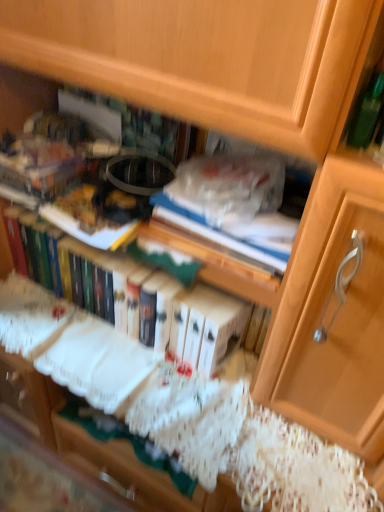
Describe the element at coordinates (150, 304) in the screenshot. This screenshot has height=512, width=384. I see `hardcover book at center` at that location.

I want to click on hardcover book at center, so click(150, 304).

What is the approximate height of blue hardcover book at center?

It is 4.76 inches.

Image resolution: width=384 pixels, height=512 pixels. What do you see at coordinates (219, 234) in the screenshot?
I see `blue hardcover book at center` at bounding box center [219, 234].

Find the location of a particular element. The image size is (384, 512). blue hardcover book at center is located at coordinates (219, 234).

Identify the location of hardcover book at center. This screenshot has width=384, height=512. (150, 304).

Does hardcover book at center appear on the left side of blue hardcover book at center?

Indeed, hardcover book at center is positioned on the left side of blue hardcover book at center.

Is the depth of hardcover book at center greater than that of blue hardcover book at center?

Yes.

Does point (135, 305) come farther from viewer compared to point (220, 233)?

That is True.

From the image's perspective, does hardcover book at center appear higher than blue hardcover book at center?

No.

In the scene shown: From a real-world perspective, is hardcover book at center physically located above or below blue hardcover book at center?

From a real-world perspective, hardcover book at center is physically below blue hardcover book at center.

Is hardcover book at center wider than blue hardcover book at center?

Yes.

Which of these two, hardcover book at center or blue hardcover book at center, stands shorter?

blue hardcover book at center.

Based on the photo, considering the relative sizes of hardcover book at center and blue hardcover book at center in the image provided, is hardcover book at center smaller than blue hardcover book at center?

Incorrect, hardcover book at center is not smaller in size than blue hardcover book at center.

Is hardcover book at center surrounding blue hardcover book at center?

Definitely not — blue hardcover book at center is not inside hardcover book at center.

Is hardcover book at center far from blue hardcover book at center?

That's not correct — hardcover book at center is a little close to blue hardcover book at center.

Is hardcover book at center facing towards blue hardcover book at center?

No, hardcover book at center is not oriented towards blue hardcover book at center.

Looking at this image, measure the distance between hardcover book at center and blue hardcover book at center.

hardcover book at center is 10.50 inches away from blue hardcover book at center.

Identify the location of book that is on the left side of blue hardcover book at center. (150, 304).

Considering the positions of objects blue hardcover book at center and hardcover book at center in the image provided, who is more to the right, blue hardcover book at center or hardcover book at center?

From the viewer's perspective, blue hardcover book at center appears more on the right side.

Is blue hardcover book at center positioned before hardcover book at center?

Yes, it is in front of hardcover book at center.

Between point (180, 217) and point (212, 290), which one is positioned in front?

Positioned in front is point (180, 217).

From the image's perspective, is blue hardcover book at center positioned above or below hardcover book at center?

Clearly, from the image's perspective, blue hardcover book at center is above hardcover book at center.

From a real-world perspective, is blue hardcover book at center located beneath hardcover book at center?

No, from a real-world perspective, blue hardcover book at center is not beneath hardcover book at center.

In terms of width, does blue hardcover book at center look wider or thinner when compared to hardcover book at center?

Clearly, blue hardcover book at center has less width compared to hardcover book at center.

Can you confirm if blue hardcover book at center is shorter than hardcover book at center?

Indeed, blue hardcover book at center has a lesser height compared to hardcover book at center.

Based on their sizes in the image, would you say blue hardcover book at center is bigger or smaller than hardcover book at center?

Clearly, blue hardcover book at center is smaller in size than hardcover book at center.

Is blue hardcover book at center completely or partially outside of hardcover book at center?

Yes, blue hardcover book at center is not within hardcover book at center.

Consider the image. Would you say blue hardcover book at center is a long distance from hardcover book at center?

No, blue hardcover book at center is not far away from hardcover book at center.

Is blue hardcover book at center facing away from hardcover book at center?

No.

Based on the photo, how distant is blue hardcover book at center from hardcover book at center?

They are 10.50 inches apart.

At what (x,y) coordinates should I click in order to perform the action: click on paperback book on the right of hardcover book at center. Please return your answer as a coordinate pair (x, y). The height and width of the screenshot is (512, 384). Looking at the image, I should click on (219, 234).

This screenshot has width=384, height=512. In order to click on paperback book lying above the hardcover book at center (from the image's perspective) in this screenshot , I will do `click(219, 234)`.

The width and height of the screenshot is (384, 512). I want to click on paperback book in front of the hardcover book at center, so click(219, 234).